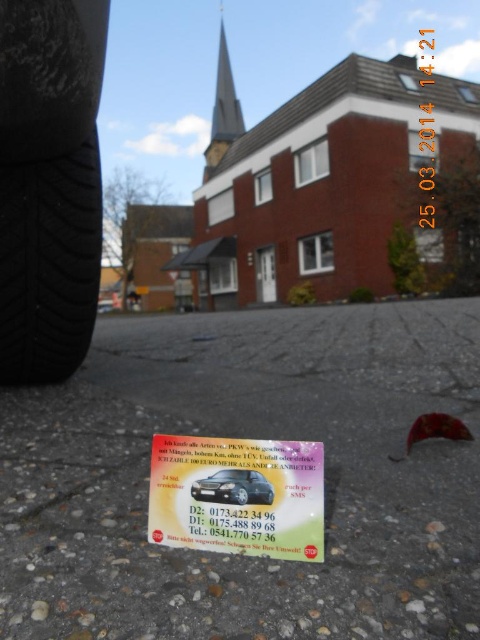
Measure the distance from black rubber tire at left to black glossy car at lower center.

black rubber tire at left and black glossy car at lower center are 4.81 feet apart.

Who is lower down, black rubber tire at left or black glossy car at lower center?

black glossy car at lower center is below.

This screenshot has width=480, height=640. Describe the element at coordinates (48, 264) in the screenshot. I see `black rubber tire at left` at that location.

Where is `black rubber tire at left`? The image size is (480, 640). black rubber tire at left is located at coordinates (48, 264).